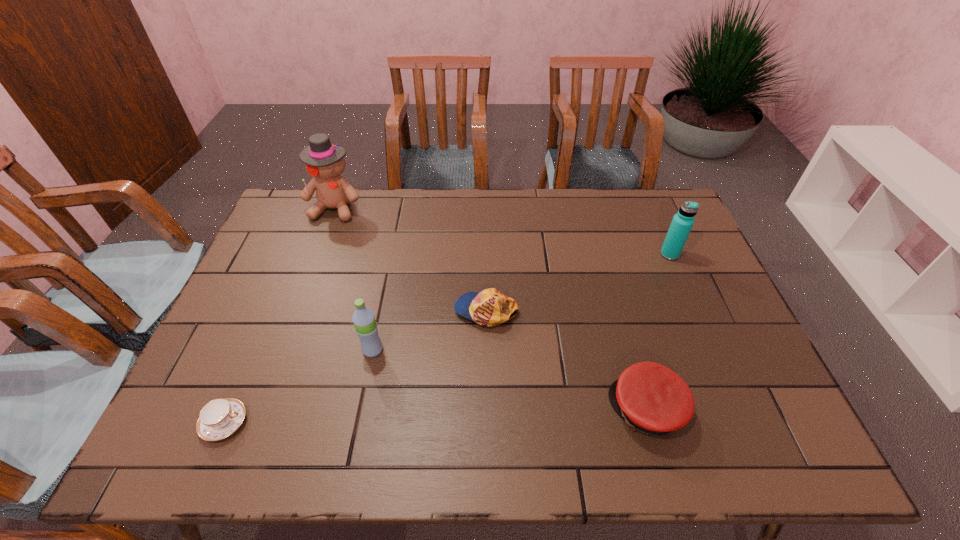
The width and height of the screenshot is (960, 540). Find the location of `rag_doll`. rag_doll is located at coordinates click(324, 161).

In order to click on the farthest object in this screenshot , I will do `click(324, 161)`.

What are the coordinates of `the rightmost object` in the screenshot? It's located at (682, 222).

Locate an element on the screen. This screenshot has width=960, height=540. the farther water bottle is located at coordinates (682, 222).

The width and height of the screenshot is (960, 540). I want to click on the nearer water bottle, so click(x=363, y=318).

Locate an element on the screen. Image resolution: width=960 pixels, height=540 pixels. the fourth farthest object is located at coordinates (363, 318).

You are a GUI agent. You are given a task and a screenshot of the screen. Output one action in this format:
    pyautogui.click(x=<x>, y=<y>)
    Task: Click on the fifth object from left to right
    
    Given the screenshot: What is the action you would take?
    pyautogui.click(x=651, y=398)

In order to click on the right cap in this screenshot , I will do `click(651, 398)`.

Image resolution: width=960 pixels, height=540 pixels. I want to click on the fourth object from left to right, so click(x=490, y=307).

This screenshot has height=540, width=960. I want to click on the left cap, so click(x=490, y=307).